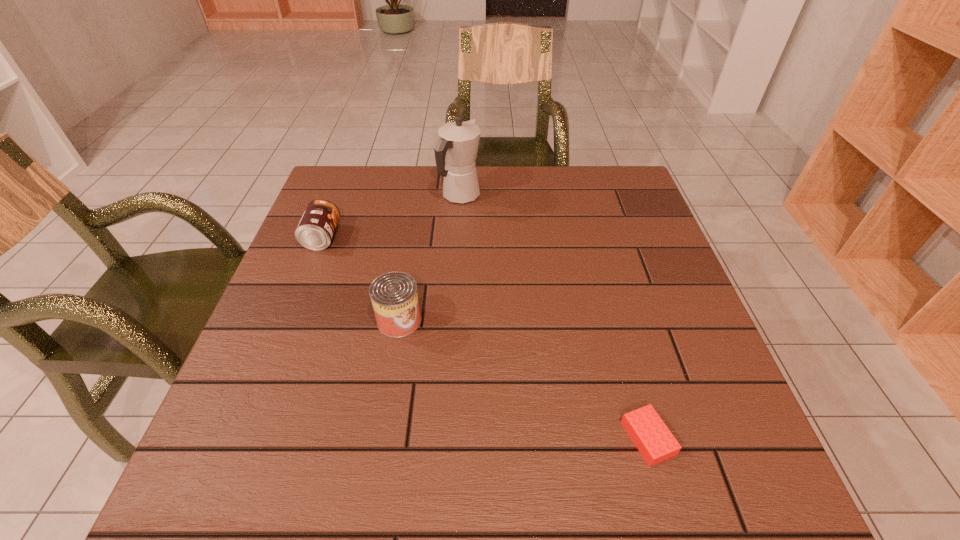
Locate an element on the screen. This screenshot has height=540, width=960. vacant space at the right edge of the desktop is located at coordinates (644, 253).

This screenshot has width=960, height=540. In the image, there is a desktop. Find the location of `vacant space at the far left corner`. vacant space at the far left corner is located at coordinates (368, 181).

The width and height of the screenshot is (960, 540). Find the location of `vacant space at the far right corner`. vacant space at the far right corner is located at coordinates (628, 200).

In order to click on vacant space in between the Lego and the farthest object in this screenshot , I will do pos(554,317).

Find the location of a particular element. The height and width of the screenshot is (540, 960). vacant area that lies between the coffeepot and the second object from left to right is located at coordinates (430, 258).

Locate an element on the screen. The image size is (960, 540). free space between the farthest object and the third object from right to left is located at coordinates (430, 258).

Find the location of `vacant area that lies between the farthest object and the leftmost object`. vacant area that lies between the farthest object and the leftmost object is located at coordinates (392, 217).

Identify the location of free spot between the shorter can and the farthest object. (392, 217).

Locate an element on the screen. free space between the nearest object and the taller can is located at coordinates (523, 379).

Where is `vacant space in between the nearest object and the farthest object`? This screenshot has width=960, height=540. vacant space in between the nearest object and the farthest object is located at coordinates pyautogui.click(x=554, y=317).